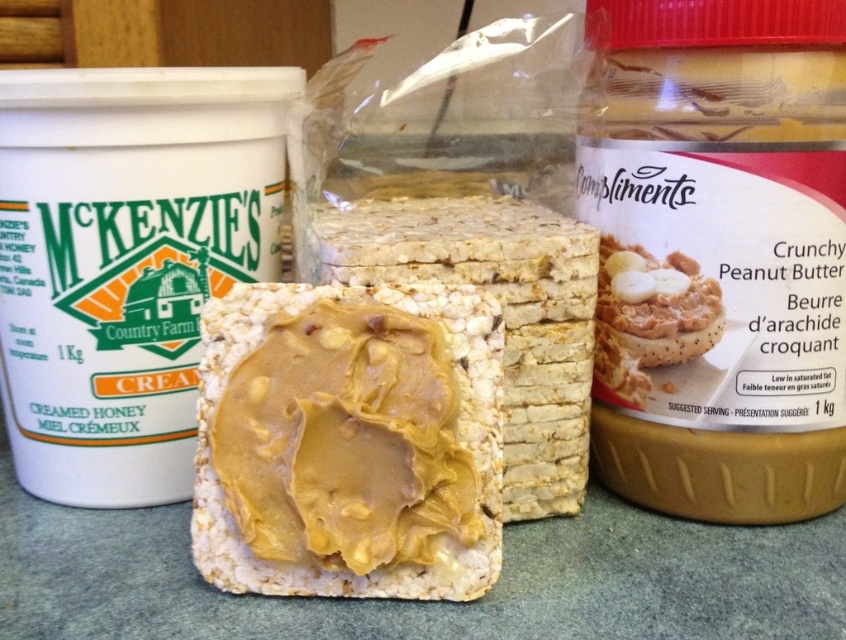
You are a food stylist arranging a photo shoot setup. You have a square rice cake with peanut butter in the foreground and a jar at point (332, 538). The camera is positioned to capture the rice cake clearly. Considering the jar is 31.57 inches away from the camera, will it appear larger or smaller in the photo compared to if it were placed closer to the camera?

The jar at point (332, 538) is 31.57 inches away from the camera. Since it is farther away, it will appear smaller in the photo than if it were placed closer to the camera.

You are a food delivery robot with a 30 cm wide tray. You need to place a new snack between the smooth peanut butter rice cake at center and the crunchy peanut butter spread at upper right. Can you fit the snack on your tray without overlapping either item?

The distance between the smooth peanut butter rice cake at center and the crunchy peanut butter spread at upper right is 30.28 centimeters. Since your tray is 30 cm wide, it can fit between them as the space is slightly larger than the tray.